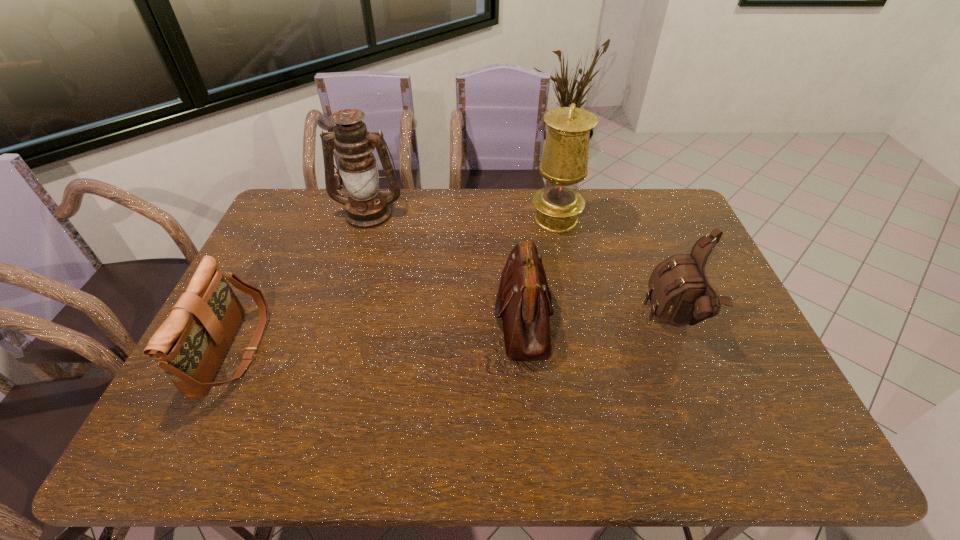
The width and height of the screenshot is (960, 540). I want to click on free point located 0.120m on the back of the second shoulder bag from left to right, so click(517, 249).

Find the location of a particular element. vacant area situated on the front-facing side of the leftmost shoulder bag is located at coordinates (372, 350).

At what (x,y) coordinates should I click in order to perform the action: click on object that is at the left edge. Please return your answer as a coordinate pair (x, y). The height and width of the screenshot is (540, 960). Looking at the image, I should click on (189, 346).

This screenshot has width=960, height=540. Identify the location of object that is at the right edge. (680, 294).

This screenshot has width=960, height=540. In the image, there is a desktop. In order to click on vacant space at the near edge in this screenshot , I will do `click(522, 437)`.

Find the location of a particular element. This screenshot has height=540, width=960. free space at the left edge is located at coordinates (265, 246).

What are the coordinates of `vacant region at the right edge` in the screenshot? It's located at (675, 242).

Locate an element on the screen. The height and width of the screenshot is (540, 960). free space at the far left corner is located at coordinates (285, 217).

Find the location of `vacant region at the near right corner of the desktop`. vacant region at the near right corner of the desktop is located at coordinates (801, 430).

This screenshot has height=540, width=960. Find the location of `empty space between the rightmost shoulder bag and the right lantern`. empty space between the rightmost shoulder bag and the right lantern is located at coordinates (615, 271).